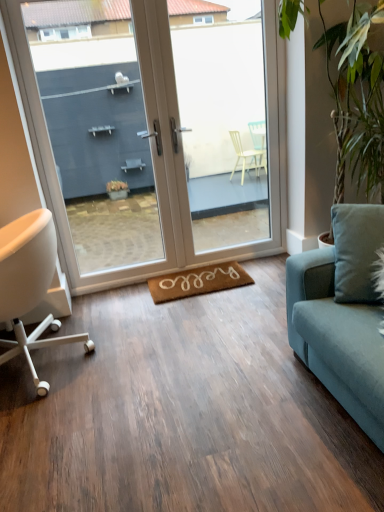
Question: Is white matte chair at left in front of or behind brown coir yoga mat at center in the image?

Choices:
 (A) behind
 (B) front

Answer: (B)

Question: Considering the positions of point (34, 215) and point (220, 280), is point (34, 215) closer or farther from the camera than point (220, 280)?

Choices:
 (A) closer
 (B) farther

Answer: (A)

Question: Which of these objects is positioned closest to the white glossy door at center?

Choices:
 (A) white matte chair at left
 (B) brown coir yoga mat at center
 (C) green leafy plant at right
 (D) transparent glass door at center

Answer: (B)

Question: Which object is the farthest from the green leafy plant at right?

Choices:
 (A) white glossy door at center
 (B) transparent glass door at center
 (C) brown coir yoga mat at center
 (D) white matte chair at left

Answer: (D)